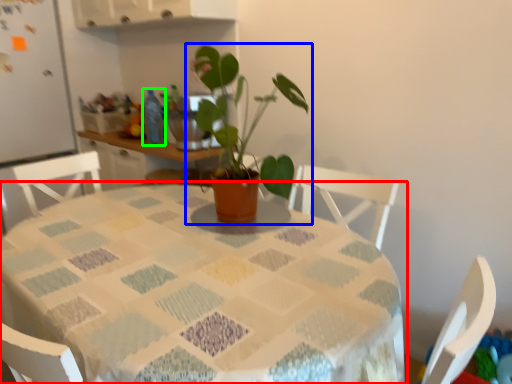
Question: Which object is positioned closest to table (highlighted by a red box)? Select from houseplant (highlighted by a blue box) and bottle (highlighted by a green box).

Choices:
 (A) houseplant
 (B) bottle

Answer: (A)